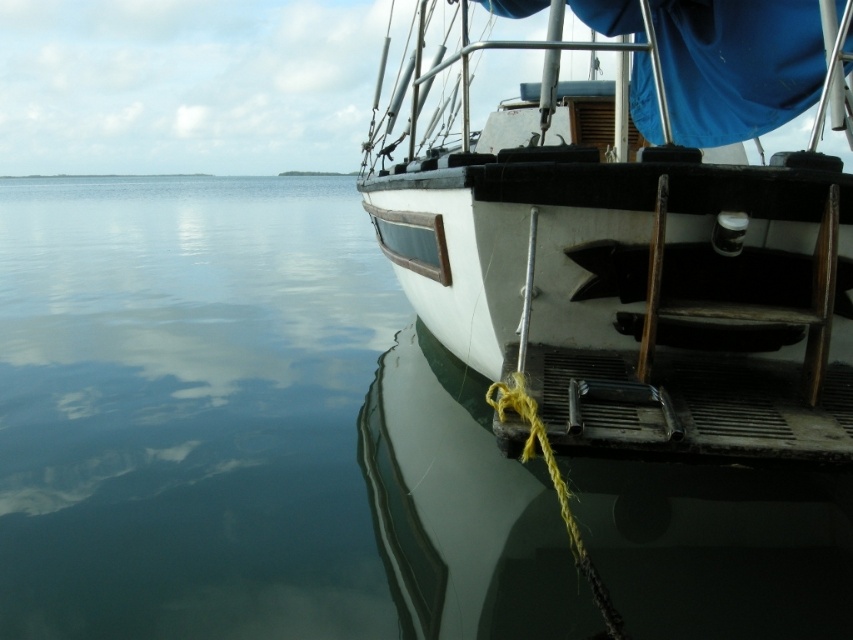
You are a photographer planning to capture the white matte boat at center and the clear water at lower left in a single frame. Which of these two elements will occupy more space in your photo?

The clear water at lower left is bigger than the white matte boat at center, so it will occupy more space in the photo.

You are standing on a pier and looking at the scene. You see the clear water at lower left and the white matte boat at center. Which object is closer to you?

The clear water at lower left is closer to you because it is further to the viewer than the white matte boat at center.

You are standing on the deck of the boat and want to locate the clear water at lower left. According to the coordinates provided, where exactly should you look?

The clear water at lower left is located at coordinates point (189,408).